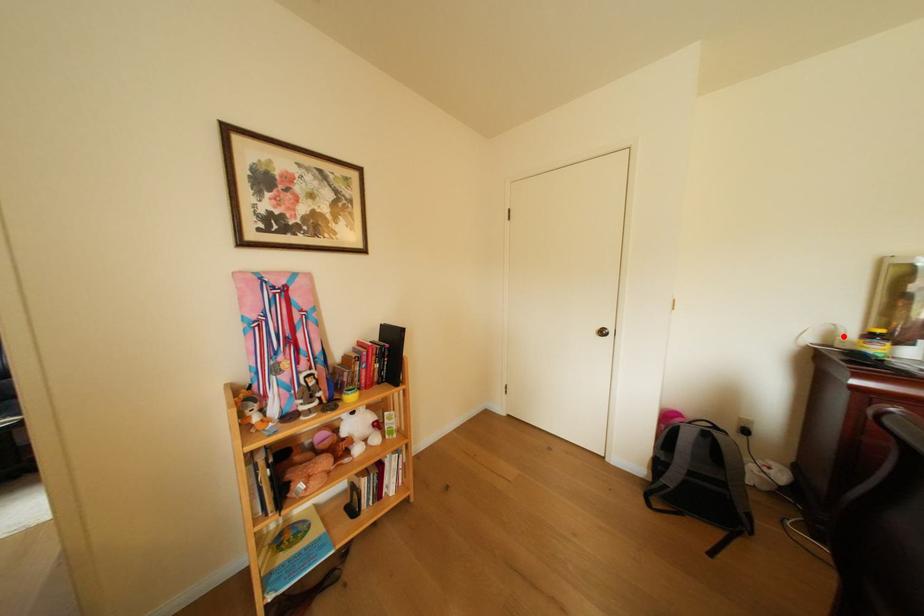
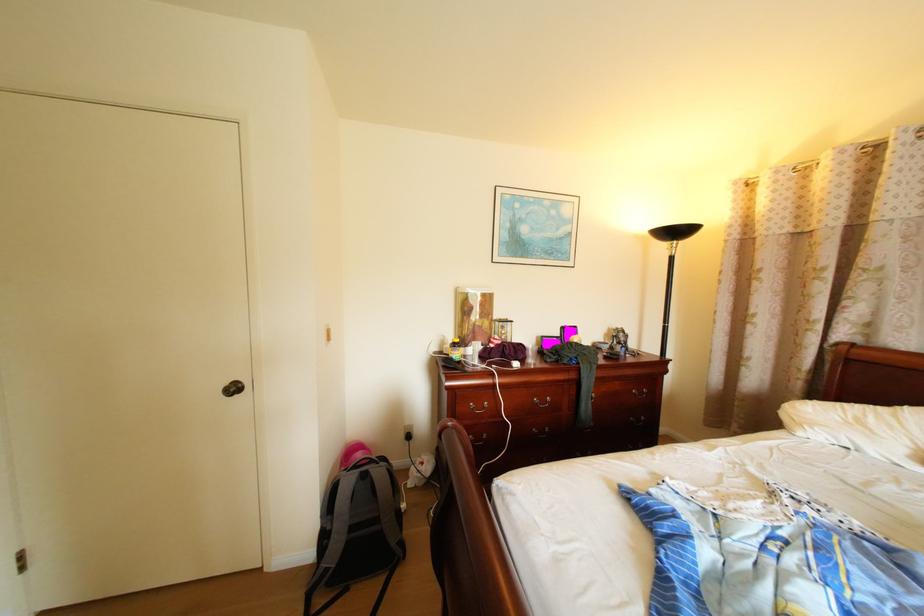
In the second image, find the point that corresponds to the highlighted location in the first image.

(456, 345)